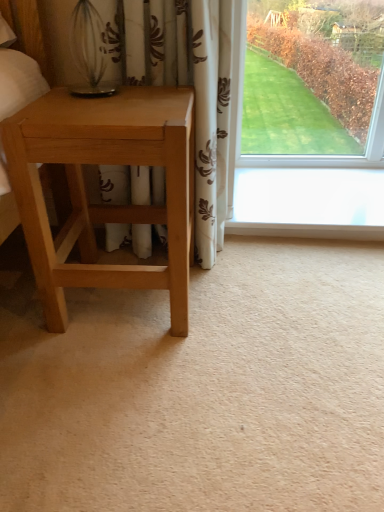
This screenshot has height=512, width=384. What do you see at coordinates (104, 205) in the screenshot?
I see `light wood nightstand at left` at bounding box center [104, 205].

Locate an element on the screen. The width and height of the screenshot is (384, 512). light wood nightstand at left is located at coordinates (104, 205).

In order to face light wood nightstand at left, should I rotate leftwards or rightwards?

You should rotate left by 8.702 degrees.

Where is `light wood nightstand at left`? Image resolution: width=384 pixels, height=512 pixels. light wood nightstand at left is located at coordinates (104, 205).